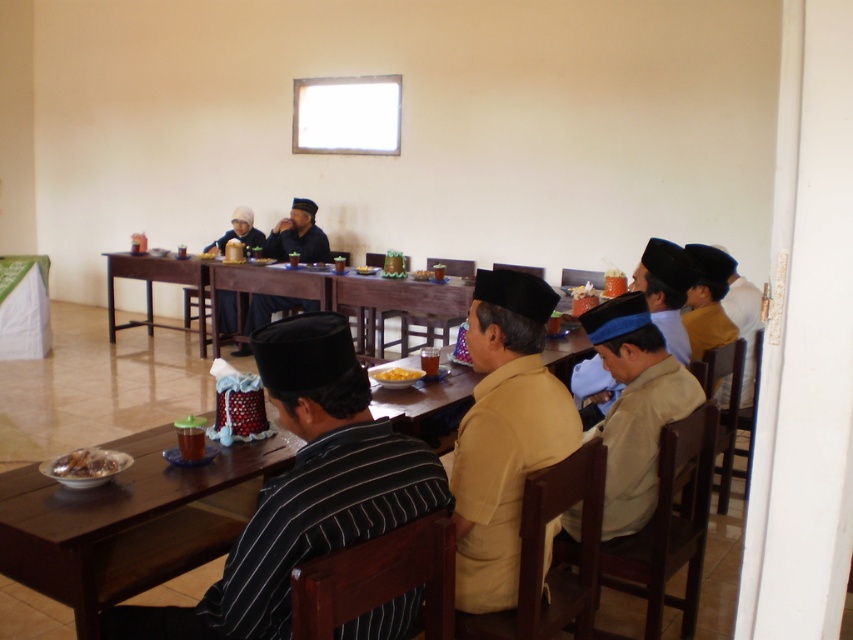
Looking at this image, you are a guest in this communal dining area and want to greet someone wearing a blue fabric headscarf at right. Which direction should you walk from the brown wooden table at center to reach them?

The brown wooden table at center is to the left of the blue fabric headscarf at right, so you should walk to the right from the brown wooden table at center to reach the blue fabric headscarf at right.

You are a photographer standing in the communal dining area. You want to take a photo that includes both the striped fabric shirt at center and the brown wooden table at lower left. Which object will appear taller in the photo?

The striped fabric shirt at center will appear taller in the photo because it has a greater height compared to the brown wooden table at lower left.

You are planning to place a rectangular gift box that is 1 meter long on the brown wooden table at lower left. Considering the table size compared to the matte black hat at upper center, can the gift box fit on the table?

The brown wooden table at lower left is larger in width than the matte black hat at upper center. However, since the exact dimensions of the table are unknown, it is uncertain whether the 1 meter long gift box will fit. More information about the table dimensions is needed to determine this.